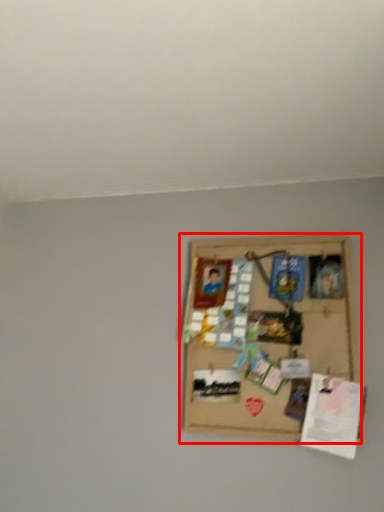
Question: From the image's perspective, where is picture frame (annotated by the red box) located in relation to plaque in the image?

Choices:
 (A) below
 (B) above

Answer: (B)